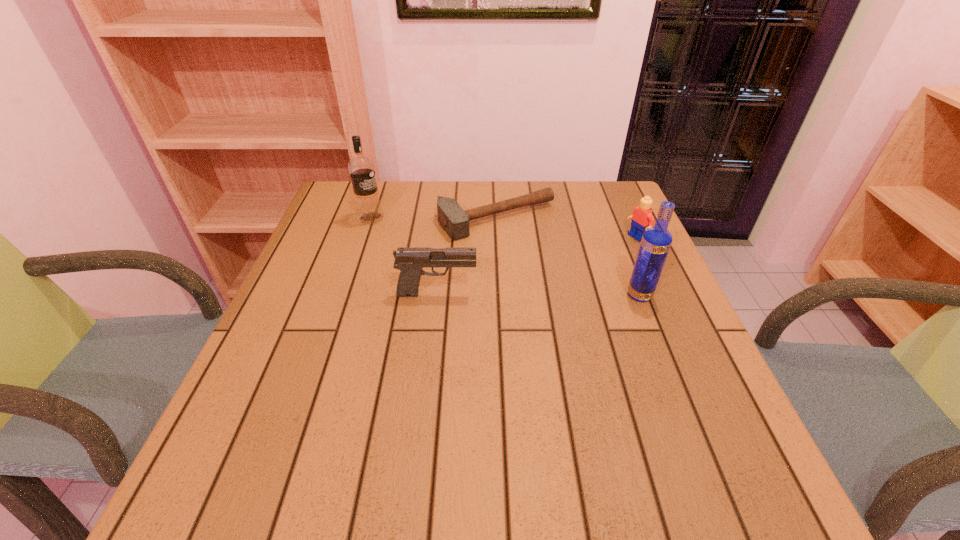
Where is `vacant space in between the hammer and the right vodka`? vacant space in between the hammer and the right vodka is located at coordinates (568, 258).

The height and width of the screenshot is (540, 960). Identify the location of vacant space that's between the hammer and the Lego. (567, 228).

This screenshot has height=540, width=960. I want to click on vacant area that lies between the farther vodka and the right vodka, so click(x=505, y=257).

This screenshot has height=540, width=960. In order to click on unoccupied area between the nearer vodka and the pistol in this screenshot , I will do pyautogui.click(x=539, y=294).

The width and height of the screenshot is (960, 540). Identify the location of object that stands as the third closest to the Lego. (410, 261).

You are a GUI agent. You are given a task and a screenshot of the screen. Output one action in this format:
    pyautogui.click(x=<x>, y=<y>)
    Task: Click on the object that ranks as the closest to the pistol
    
    Given the screenshot: What is the action you would take?
    pyautogui.click(x=455, y=221)